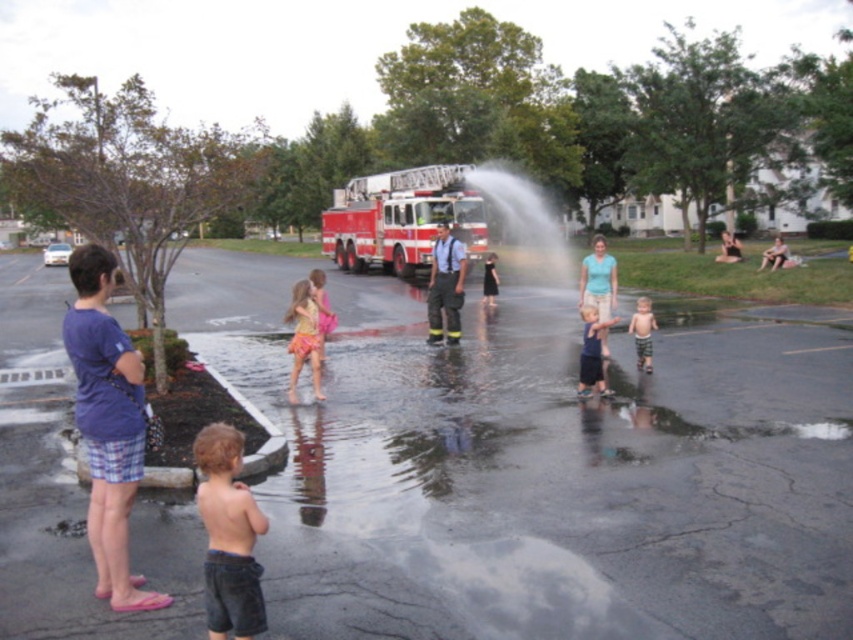
Which is more to the left, denim shorts at lower left or reflective silver helmet at center?

denim shorts at lower left

Which is behind, point (215, 541) or point (442, 305)?

The point (442, 305) is behind.

Find the location of a particular element. The height and width of the screenshot is (640, 853). denim shorts at lower left is located at coordinates (228, 536).

The height and width of the screenshot is (640, 853). Find the location of `red shiny fire truck at center`. red shiny fire truck at center is located at coordinates (401, 218).

Is red shiny fire truck at center to the right of light blue cotton shirt at center from the viewer's perspective?

Incorrect, red shiny fire truck at center is not on the right side of light blue cotton shirt at center.

Is point (416, 177) closer to viewer compared to point (595, 273)?

No, it is not.

Where is `red shiny fire truck at center`? red shiny fire truck at center is located at coordinates (401, 218).

Is purple fabric shirt at left taller than blurred fabric person at center?

No, purple fabric shirt at left is not taller than blurred fabric person at center.

Which is more to the left, purple fabric shirt at left or blurred fabric person at center?

purple fabric shirt at left

Locate an element on the screen. This screenshot has height=640, width=853. purple fabric shirt at left is located at coordinates (107, 424).